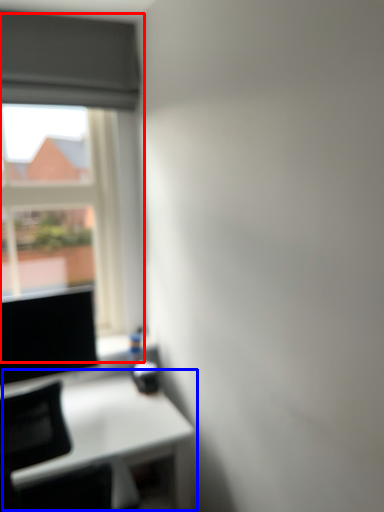
Question: Which of the following is the closest to the observer, window (highlighted by a red box) or table (highlighted by a blue box)?

Choices:
 (A) window
 (B) table

Answer: (B)